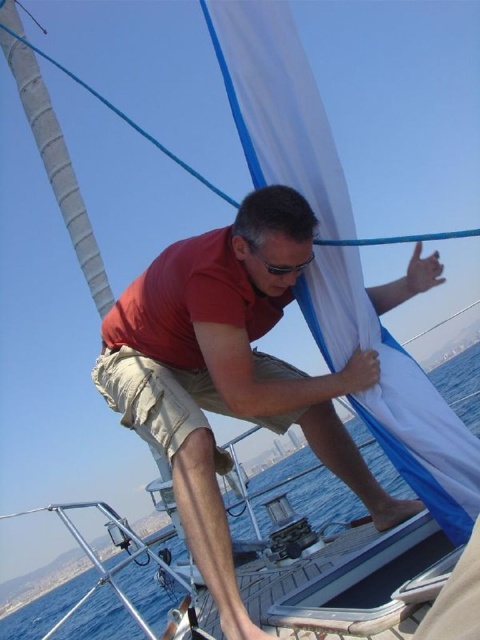
Question: Can you confirm if red matte shirt at center is positioned below black plastic goggles at center?

Choices:
 (A) no
 (B) yes

Answer: (B)

Question: Is red matte shirt at center positioned in front of black plastic goggles at center?

Choices:
 (A) yes
 (B) no

Answer: (A)

Question: Among these points, which one is nearest to the camera?

Choices:
 (A) (250, 252)
 (B) (204, 531)

Answer: (B)

Question: Can you confirm if red matte shirt at center is positioned to the right of black plastic goggles at center?

Choices:
 (A) yes
 (B) no

Answer: (B)

Question: Among these points, which one is nearest to the camera?

Choices:
 (A) (215, 490)
 (B) (307, 262)

Answer: (A)